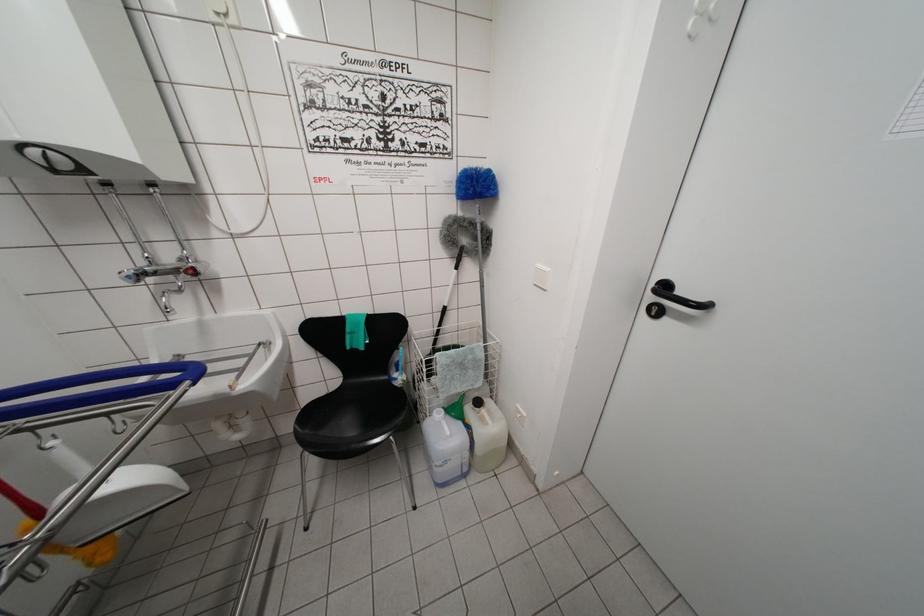
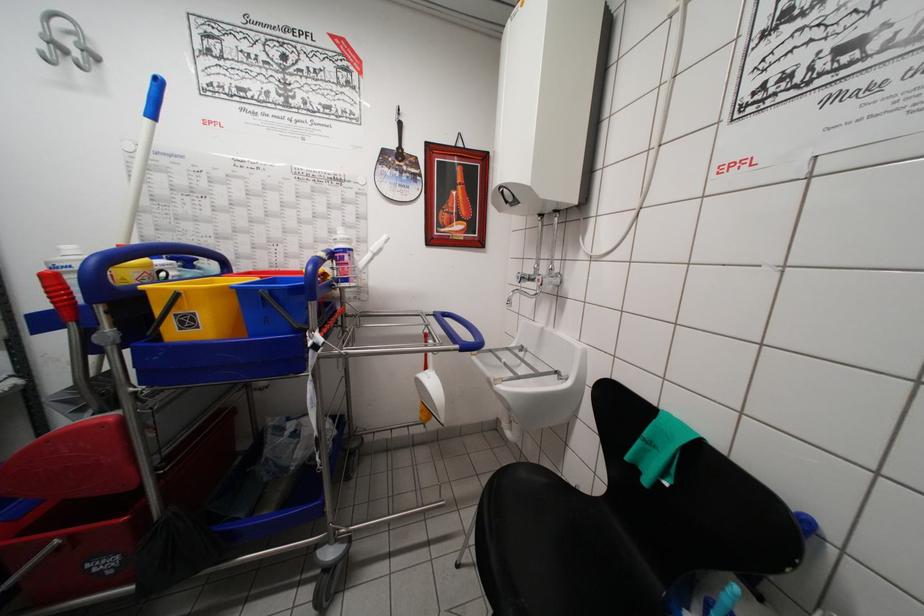
In the second image, find the point that corresponds to point 131,282 in the first image.

(521, 282)